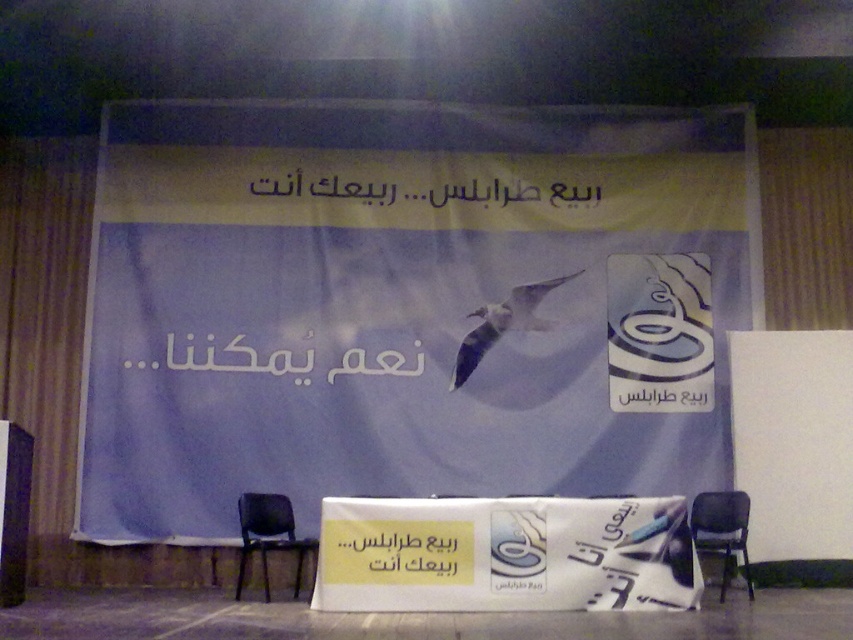
You are an event organizer and need to place a new decorative item between the white glossy banner at center and the white glossy bird at center. Based on their current positions, which object should the new item be placed closer to?

The new decorative item should be placed closer to the white glossy bird at center because the white glossy banner at center is to the left of the white glossy bird at center, meaning there is more space to the right side of the bird.